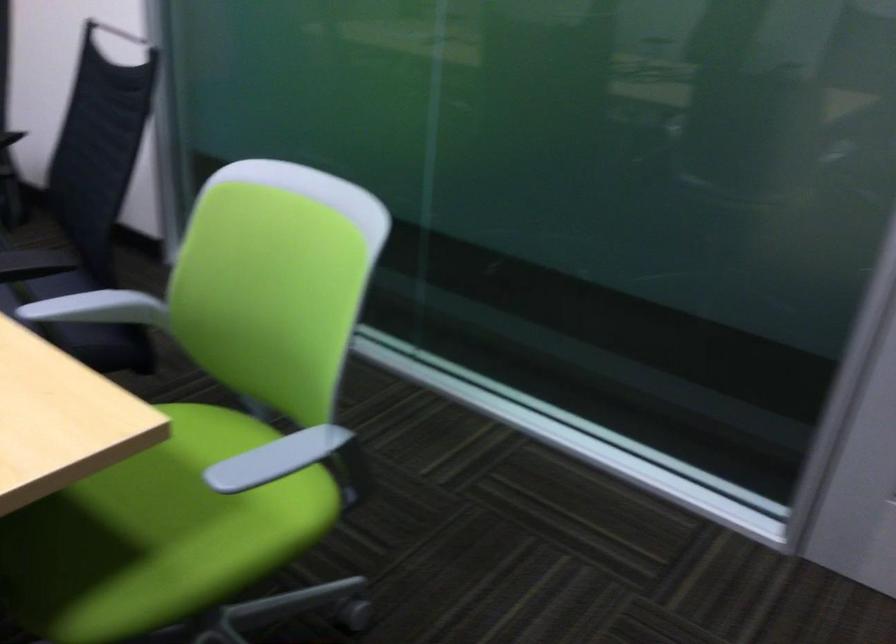
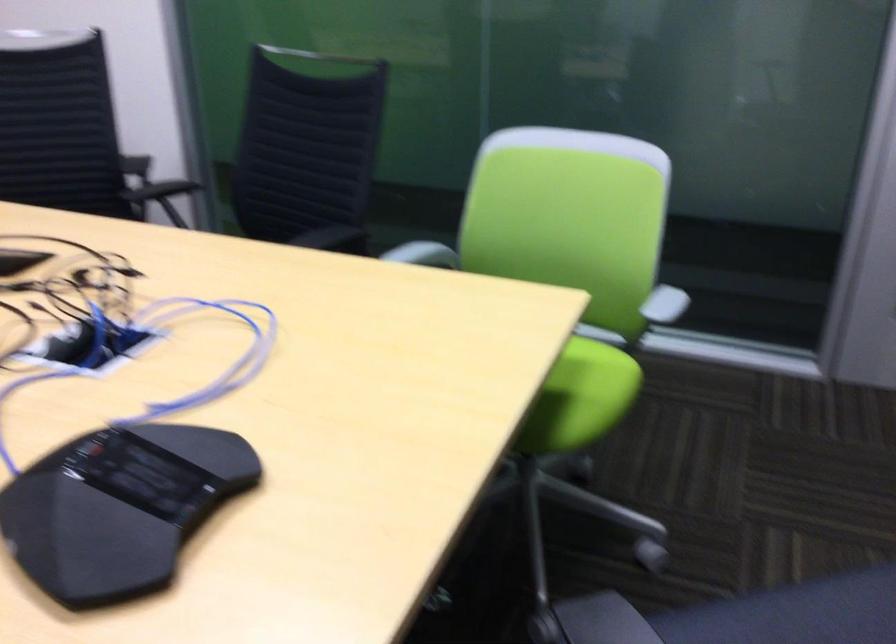
In the second image, find the point that corresponds to point (261, 476) in the first image.

(659, 310)